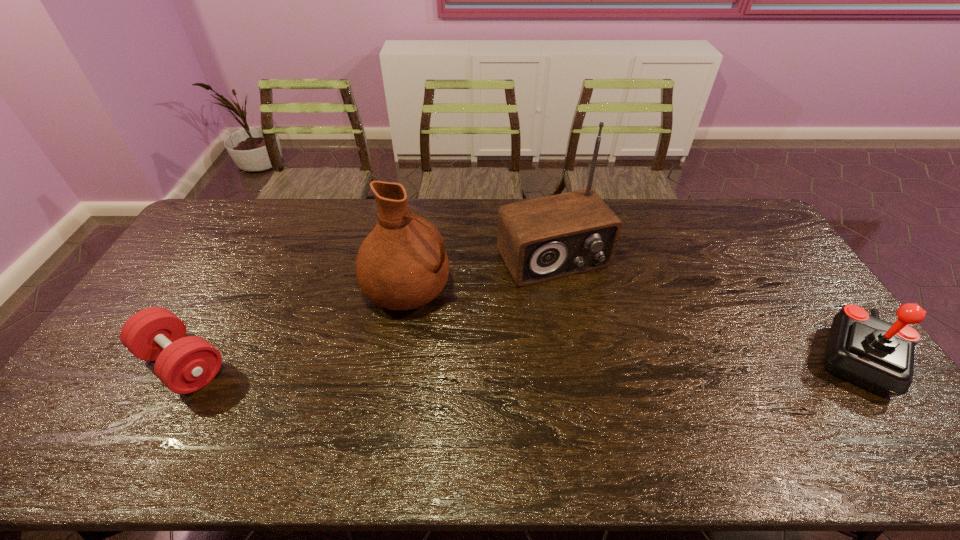
Find the location of `vacant space on the desktop that is between the shortest object and the rightmost object and is positioned on the side of the third object from right to left with the handle`. vacant space on the desktop that is between the shortest object and the rightmost object and is positioned on the side of the third object from right to left with the handle is located at coordinates (562, 361).

This screenshot has height=540, width=960. I want to click on vacant spot on the desktop that is between the dumbbell and the second shortest object and is positioned on the front-facing side of the second object from right to left, so click(x=619, y=360).